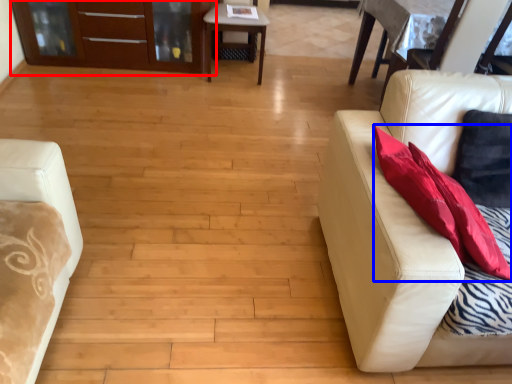
Question: Which object is further to the camera taking this photo, dresser (highlighted by a red box) or throw pillow (highlighted by a blue box)?

Choices:
 (A) dresser
 (B) throw pillow

Answer: (A)